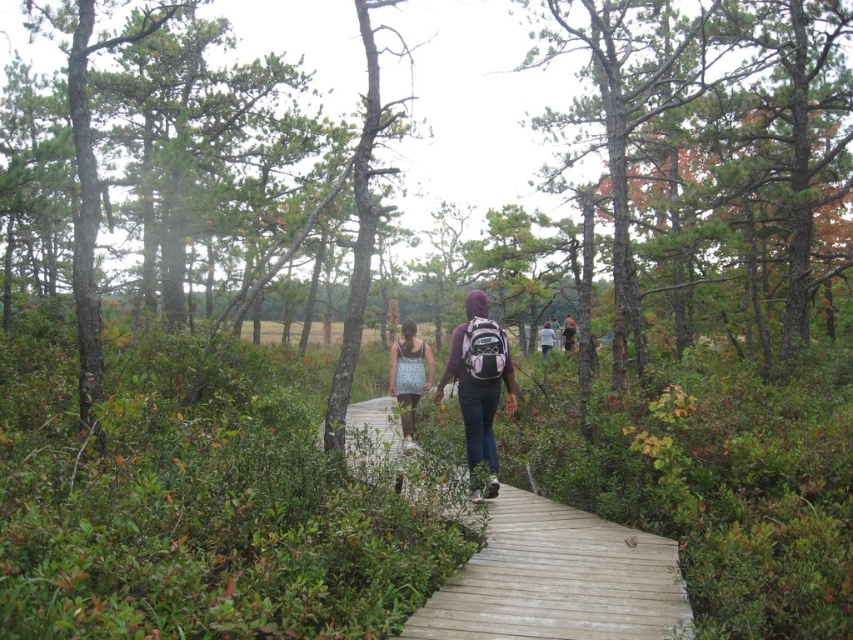
You are a photographer trying to capture both the patterned fabric dress at center and the pink backpack at center in the same frame. Based on their positions, which one should you focus on first to ensure both are in focus?

The patterned fabric dress at center is positioned under the pink backpack at center, so focusing on the pink backpack at center first would allow the dress to be in focus as well since it is closer to the camera.

You are standing at the starting point of the boardwalk and want to reach the point marked at coordinates (601,541). Given that the boardwalk is 12 feet wide, can you walk straight towards the point without stepping off the boardwalk?

The point marked at coordinates (601,541) is 16.34 feet away from the viewer. Since the boardwalk is only 12 feet wide, walking straight towards the point would take you beyond the boardwalk, so you cannot reach it without stepping off.

You are standing at the point labeled point (x=482, y=451) and want to walk to the point labeled point (x=563, y=602). Which direction should you move relative to your current position?

You should move forward because point (x=563, y=602) is closer to the camera than point (x=482, y=451), meaning it is in front of your current position.